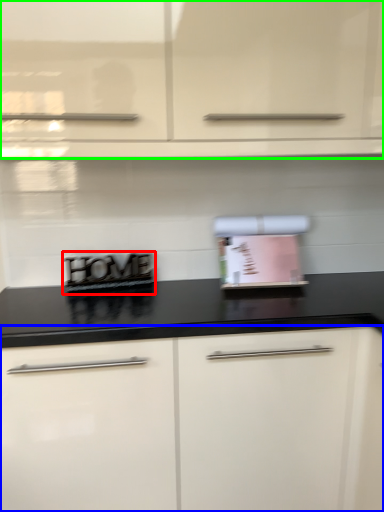
Question: Which object is positioned farthest from appliance (highlighted by a red box)? Select from cabinetry (highlighted by a blue box) and cabinetry (highlighted by a green box).

Choices:
 (A) cabinetry
 (B) cabinetry

Answer: (B)